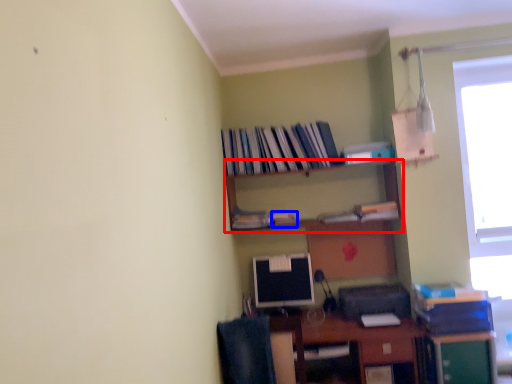
Question: Among these objects, which one is farthest to the camera, shelf (highlighted by a red box) or book (highlighted by a blue box)?

Choices:
 (A) shelf
 (B) book

Answer: (B)